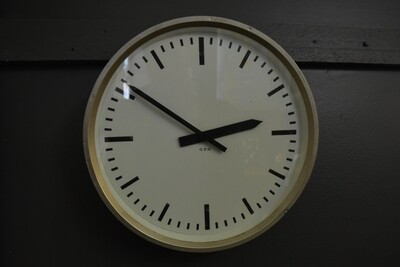
The width and height of the screenshot is (400, 267). I want to click on nail holes, so click(x=317, y=45), click(x=364, y=45).